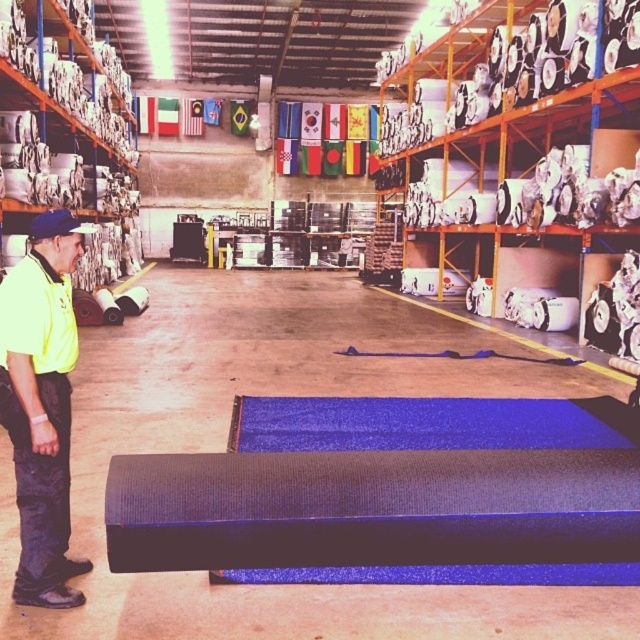
From the picture: You are a warehouse worker who needs to retrieve the yellow fabric uniform at left and the matte white paper at right. Based on their positions, which item would you need to move first to access the other?

The yellow fabric uniform at left is behind matte white paper at right, so you would need to move the matte white paper at right first to access the yellow fabric uniform at left.

You are a warehouse worker who needs to determine the thickness of the items to ensure proper storage. Which item is thinner between the matte white paper at right and the matte white fabric at left?

The matte white paper at right is thinner than the matte white fabric at left according to the description.